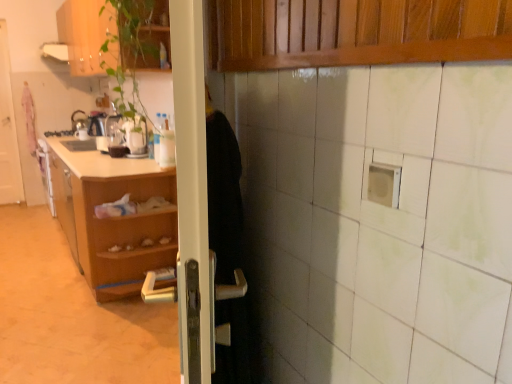
Question: Do you think white glossy door at left is within wooden cabinet at upper left, or outside of it?

Choices:
 (A) outside
 (B) inside

Answer: (A)

Question: Considering the positions of white glossy door at left and wooden cabinet at upper left in the image, is white glossy door at left taller or shorter than wooden cabinet at upper left?

Choices:
 (A) short
 (B) tall

Answer: (B)

Question: Based on their relative distances, which object is farther from the white glossy exhaust hood at upper left?

Choices:
 (A) wooden cabinet at upper left
 (B) shiny metallic kettle at left
 (C) wooden at left
 (D) white glossy door at left

Answer: (C)

Question: Considering the real-world distances, which object is closest to the white glossy door at left?

Choices:
 (A) wooden at left
 (B) white glossy exhaust hood at upper left
 (C) shiny metallic kettle at left
 (D) wooden cabinet at upper left

Answer: (B)